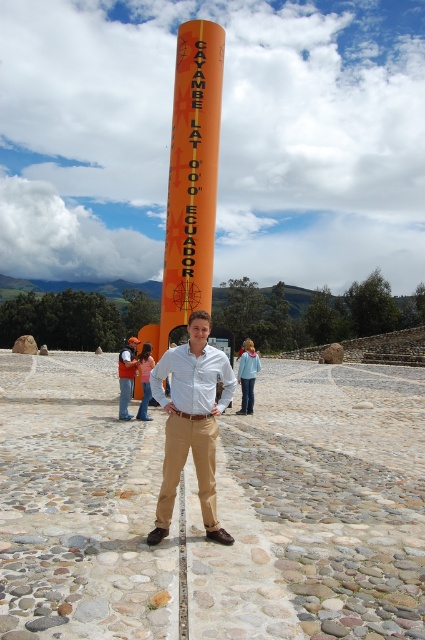
You are a photographer trying to capture a photo of the man at the Equator marker. You notice the matte khaki pants at center and the matte white shirt at center. Which item should you focus on to ensure the man is centered in your photo?

You should focus on the matte white shirt at center because the matte khaki pants at center is in front of it, meaning the shirt is closer to the background and the pants are closer to the viewer. To center the man, focus on the shirt which is positioned behind the pants but still part of his upper body.